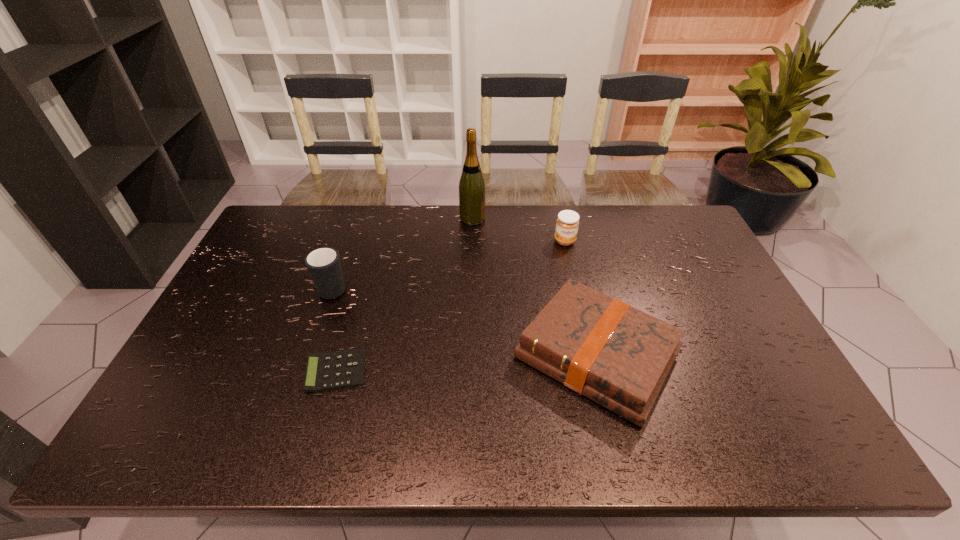
You are a GUI agent. You are given a task and a screenshot of the screen. Output one action in this format:
    pyautogui.click(x=<x>, y=<y>)
    Task: Click on the tallest object
    This screenshot has height=540, width=960.
    Given the screenshot: What is the action you would take?
    pyautogui.click(x=472, y=190)

The image size is (960, 540). Identify the location of the farthest object. (472, 190).

Image resolution: width=960 pixels, height=540 pixels. Identify the location of mug. (323, 264).

You are a GUI agent. You are given a task and a screenshot of the screen. Output one action in this format:
    pyautogui.click(x=<x>, y=<y>)
    Task: Click on the second farthest object
    The width and height of the screenshot is (960, 540).
    Given the screenshot: What is the action you would take?
    pyautogui.click(x=567, y=223)

At what (x,y) coordinates should I click in order to perform the action: click on hardback book. Please return your answer as a coordinate pair (x, y). Looking at the image, I should click on (618, 356).

Identify the location of the shortest object. (328, 371).

Locate an element on the screen. The width and height of the screenshot is (960, 540). vacant space located 0.170m on the front-facing side of the third object from left to right is located at coordinates (532, 219).

Where is `free space located on the side of the mug with the handle`? The image size is (960, 540). free space located on the side of the mug with the handle is located at coordinates (356, 221).

Identify the location of vacant space located on the side of the mug with the handle. (347, 252).

Where is `vacant space located 0.270m on the side of the mug with the handle`? The height and width of the screenshot is (540, 960). vacant space located 0.270m on the side of the mug with the handle is located at coordinates (356, 221).